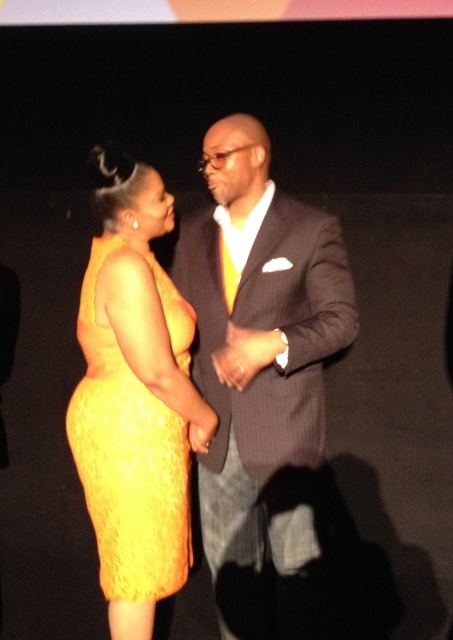
Question: Which point is farther from the camera taking this photo?

Choices:
 (A) (87, 422)
 (B) (256, 509)

Answer: (B)

Question: Which point is closer to the camera taking this photo?

Choices:
 (A) (258, 506)
 (B) (134, 490)

Answer: (B)

Question: Does matte black suit at center appear on the left side of yellow lace dress at left?

Choices:
 (A) yes
 (B) no

Answer: (B)

Question: Which point appears closest to the camera in this image?

Choices:
 (A) (217, 348)
 (B) (101, 515)

Answer: (B)

Question: Can you confirm if matte black suit at center is smaller than yellow lace dress at left?

Choices:
 (A) yes
 (B) no

Answer: (B)

Question: Does matte black suit at center lie in front of yellow lace dress at left?

Choices:
 (A) no
 (B) yes

Answer: (B)